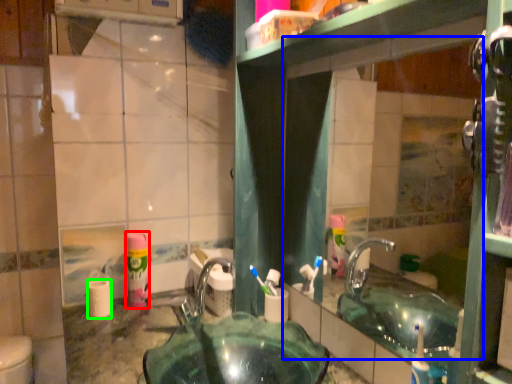
Question: Which object is positioned closest to mouthwash (highlighted by a red box)? Select from mirror (highlighted by a blue box) and toilet paper (highlighted by a green box).

Choices:
 (A) mirror
 (B) toilet paper

Answer: (B)